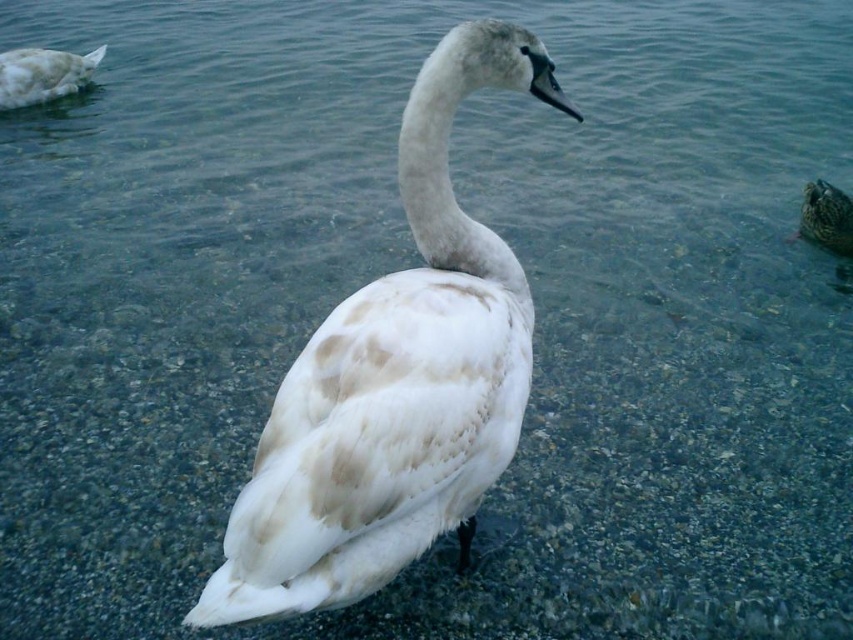
You are a photographer trying to capture a shot of the white fluffy duck at upper left and the speckled brown duck at right. Based on their sizes, which duck would appear larger in your photo?

The white fluffy duck at upper left might appear larger in your photo since it might be wider than the speckled brown duck at right.

Based on the photo, you are observing a pond scene with a swan and two ducks. The white fluffy duck at upper left and the speckled brown duck at right are both present. Based on their positions, which duck is higher up in the image?

The white fluffy duck at upper left is higher up in the image because it is positioned above the speckled brown duck at right.

You are a photographer trying to capture a closeup of the white fluffy swan at center and the speckled brown duck at right in the same frame. Given that your camera has a maximum focus range of 2 meters, will you be able to include both subjects in the shot?

The white fluffy swan at center and the speckled brown duck at right are 2.54 meters apart from each other. Since the distance between them exceeds the camera focus range of 2 meters, you cannot include both subjects in the same focused frame.